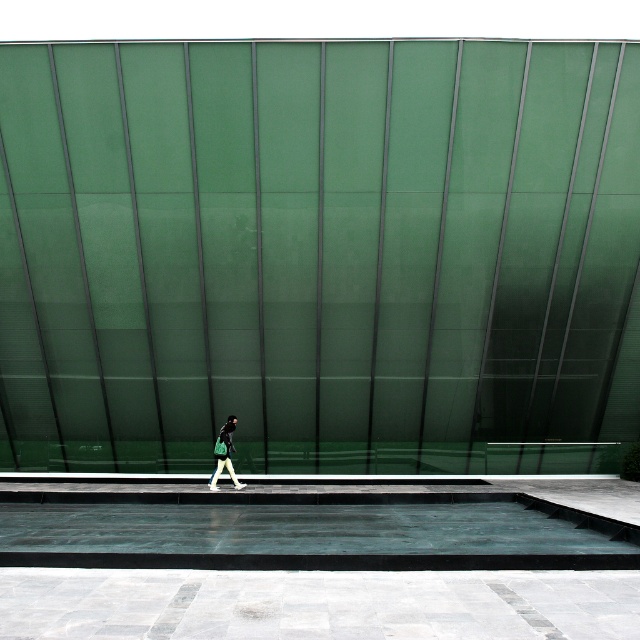
Can you confirm if smooth concrete pool at center is positioned above matte black jacket at center?

Actually, smooth concrete pool at center is below matte black jacket at center.

Which is below, smooth concrete pool at center or matte black jacket at center?

smooth concrete pool at center is lower down.

Where is `smooth concrete pool at center`? Image resolution: width=640 pixels, height=640 pixels. smooth concrete pool at center is located at coordinates (307, 531).